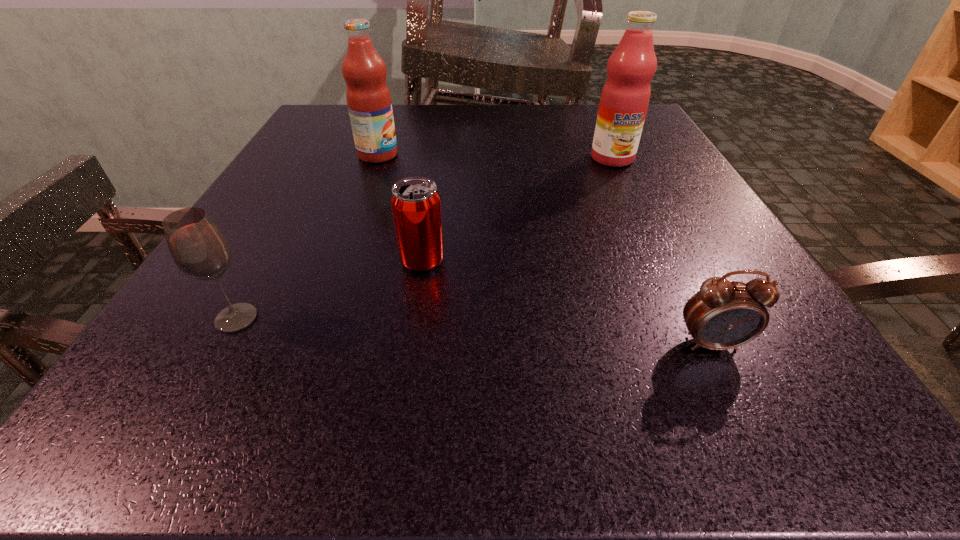
The height and width of the screenshot is (540, 960). Identify the location of vacant space situated on the back of the third nearest object. (434, 186).

I want to click on vacant area located on the face of the alarm clock, so click(739, 400).

At what (x,y) coordinates should I click in order to perform the action: click on object that is at the far edge. Please return your answer as a coordinate pair (x, y). This screenshot has width=960, height=540. Looking at the image, I should click on (368, 97).

Where is `fruit juice that is at the left edge`? The image size is (960, 540). fruit juice that is at the left edge is located at coordinates (368, 97).

This screenshot has height=540, width=960. Identify the location of glass drink container that is at the left edge. (198, 247).

Image resolution: width=960 pixels, height=540 pixels. What are the coordinates of `fruit juice located at the right edge` in the screenshot? It's located at (625, 96).

Image resolution: width=960 pixels, height=540 pixels. In order to click on alarm clock at the right edge in this screenshot , I will do `click(724, 314)`.

What are the coordinates of `object that is at the far left corner` in the screenshot? It's located at (368, 97).

This screenshot has width=960, height=540. In the image, there is a desktop. Identify the location of vacant space at the far edge. (499, 137).

The height and width of the screenshot is (540, 960). I want to click on free spot at the near edge of the desktop, so click(x=510, y=428).